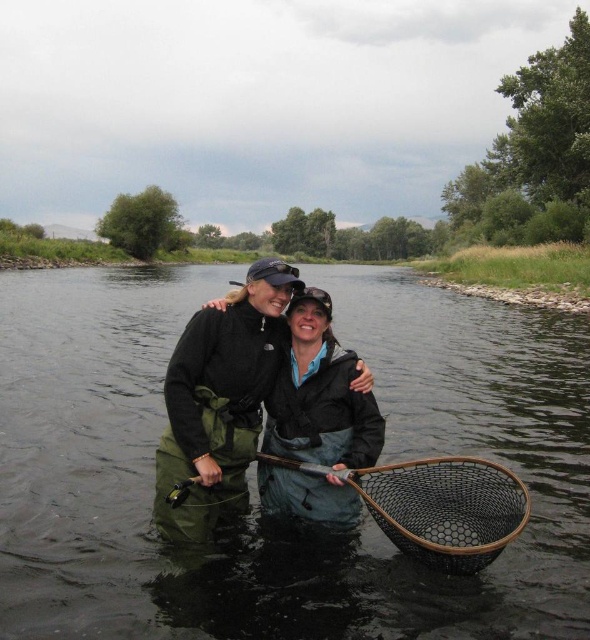
You are a photographer trying to capture a clear shot of the green waterproof jacket at center and the black matte jacket at center. Since both are overlapping, which jacket should you focus on to ensure the other is visible behind it?

The green waterproof jacket at center is positioned over black matte jacket at center, so focusing on the green waterproof jacket at center will allow the black matte jacket at center to be visible behind it.

You are a photographer aiming to capture both the clear water at center and the black matte jacket at center in the same frame. Based on their positions, which object should you adjust your camera to focus on first to ensure both are in the shot?

The clear water at center is positioned on the left side of black matte jacket at center. To capture both in the same frame, focus on the black matte jacket at center first since it is on the right, then adjust the camera to include the clear water at center on the left.

You are a photographer trying to capture a photo of the clear water at center and the green waterproof jacket at center. Which object should you focus on first if you want to include both in your shot without moving the camera?

The clear water at center is to the left of the green waterproof jacket at center, so you should focus on the green waterproof jacket at center first since it is closer to the right side of the frame.